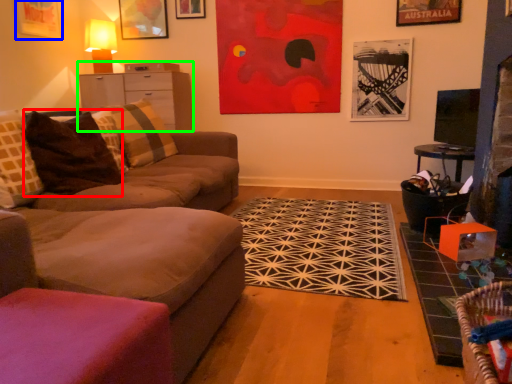
Question: Which object is positioned closest to pillow (highlighted by a red box)? Select from picture frame (highlighted by a blue box) and entertainment center (highlighted by a green box).

Choices:
 (A) picture frame
 (B) entertainment center

Answer: (B)